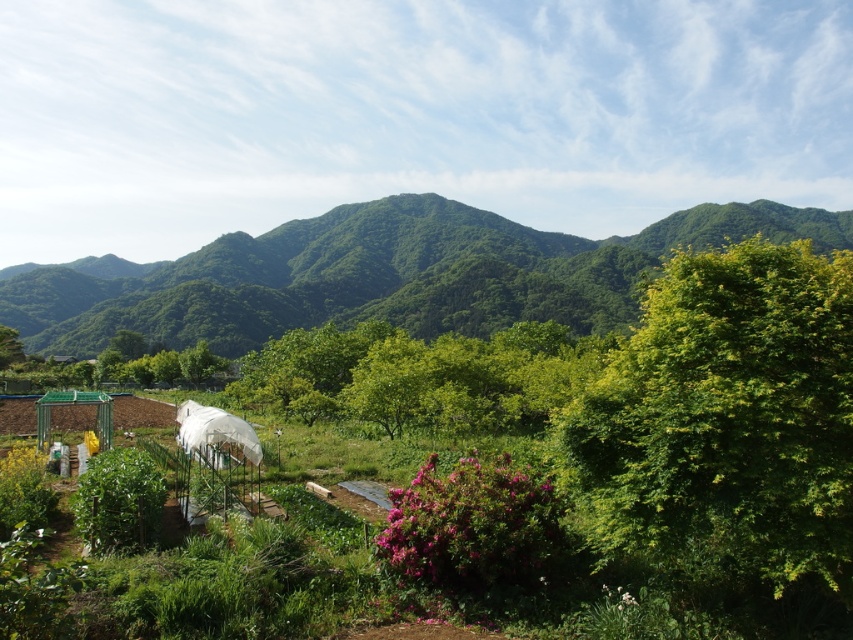
Measure the distance between green plastic greenhouse at lower left and camera.

24.69 feet

Is green plastic greenhouse at lower left to the left of green leafy mountain at upper center from the viewer's perspective?

Correct, you'll find green plastic greenhouse at lower left to the left of green leafy mountain at upper center.

Measure the distance between green plastic greenhouse at lower left and camera.

A distance of 7.53 meters exists between green plastic greenhouse at lower left and camera.

At what (x,y) coordinates should I click in order to perform the action: click on green plastic greenhouse at lower left. Please return your answer as a coordinate pair (x, y). The height and width of the screenshot is (640, 853). Looking at the image, I should click on (627, 445).